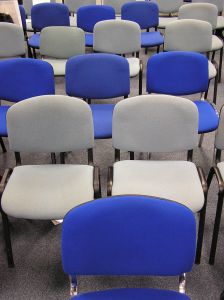
Where is `carpet`? The height and width of the screenshot is (300, 224). carpet is located at coordinates (35, 282).